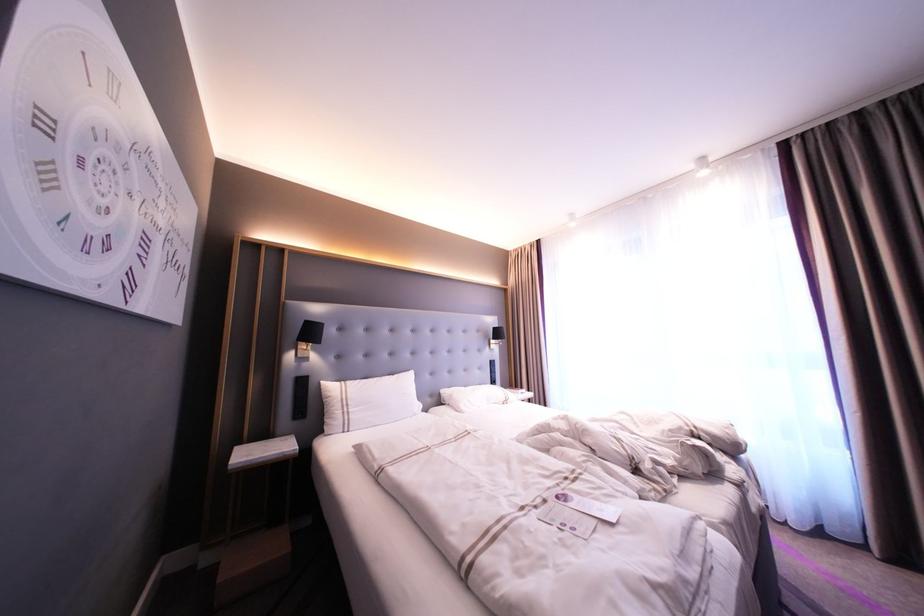
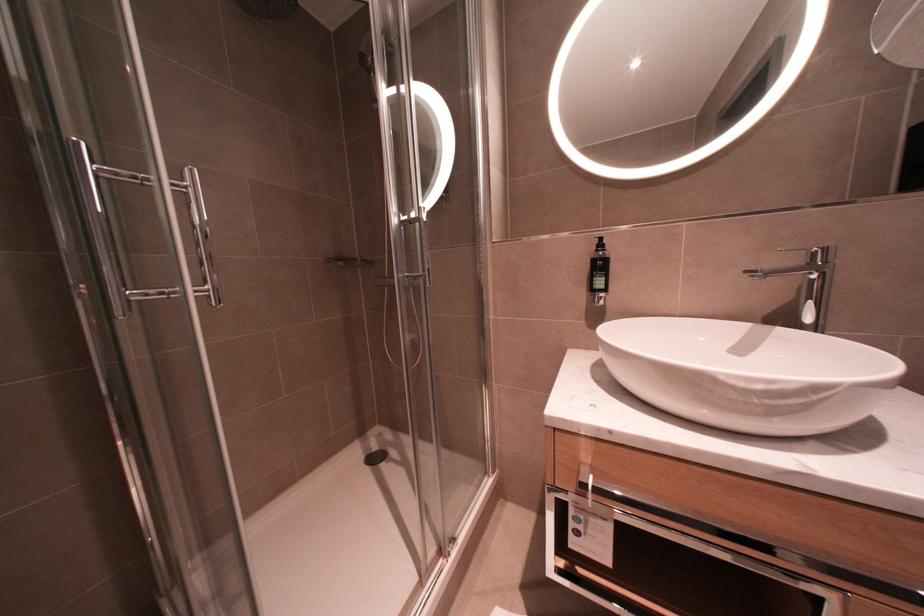
Question: What movement of the cameraman would produce the second image?

Choices:
 (A) Left
 (B) Right
 (C) Forward
 (D) Backward

Answer: (A)